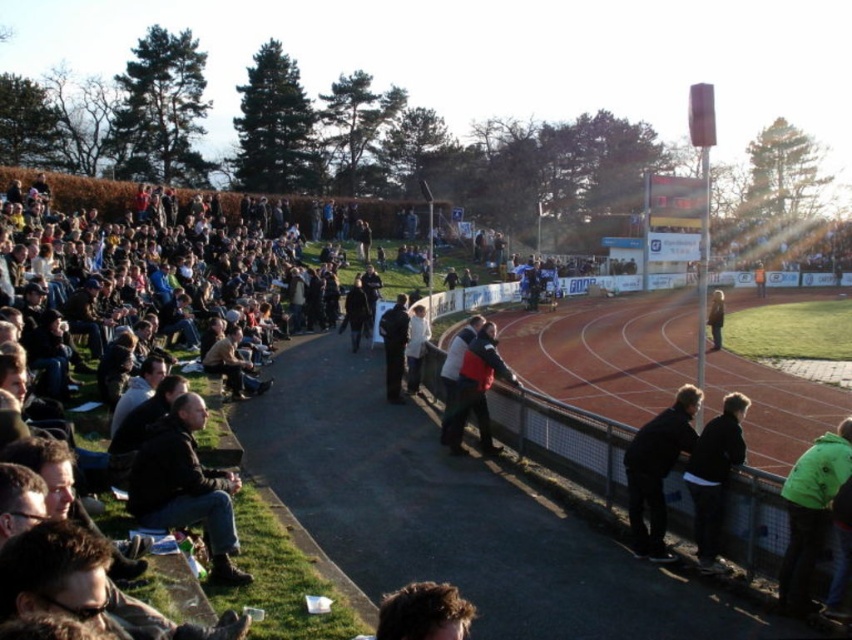
You are a runner preparing for a sprint. You see the smooth red track at center and the green fleece jacket at lower right. Which surface would provide better traction for your running shoes?

The smooth red track at center provides better traction for running shoes compared to the green fleece jacket at lower right because tracks are designed for athletic performance and have a non slippery surface, while fleece jackets are soft and not suitable for running on.

You are a photographer standing at the edge of the track. You want to take a photo of the red jacket at center and dark gray jacket at center without any obstruction. Which jacket should you focus on first to ensure it appears in the foreground?

The red jacket at center is below dark gray jacket at center, so you should focus on the red jacket at center first as it is closer to the camera.

You are a photographer trying to capture a photo of the red jacket at center and dark gray jacket at center. Which jacket should you focus on first if you want to include both in the frame without moving the camera?

You should focus on the red jacket at center first because it is shorter than the dark gray jacket at center, allowing you to position it lower in the frame while still including the taller jacket.